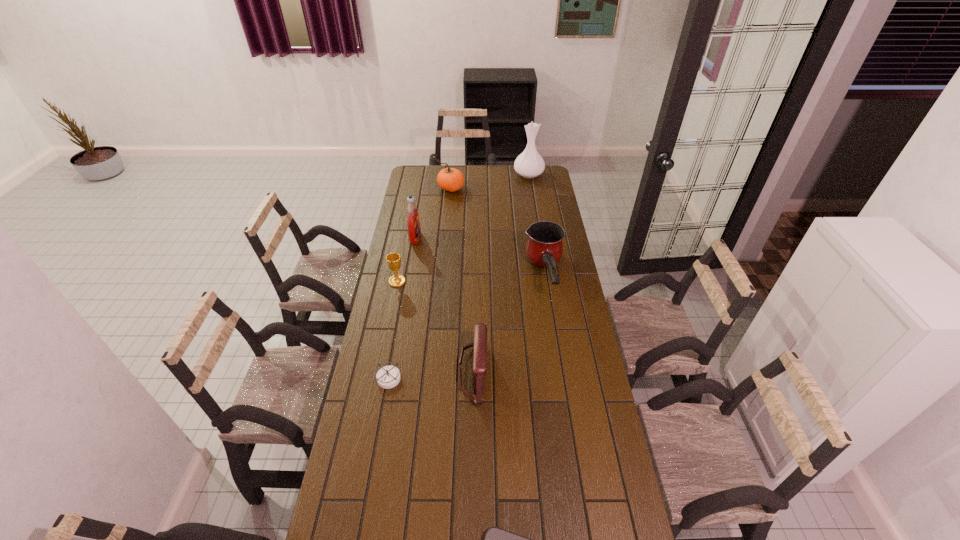
The width and height of the screenshot is (960, 540). Find the location of `vacant space situated 0.080m on the handle side of the fourth tallest object`. vacant space situated 0.080m on the handle side of the fourth tallest object is located at coordinates (553, 327).

Image resolution: width=960 pixels, height=540 pixels. Find the location of `free space located 0.320m on the front flap of the shoulder bag`. free space located 0.320m on the front flap of the shoulder bag is located at coordinates (573, 371).

Locate an element on the screen. vacant space located on the front of the chalice is located at coordinates [x=386, y=338].

Where is `vacant space located 0.360m on the right of the seventh tallest object`? The width and height of the screenshot is (960, 540). vacant space located 0.360m on the right of the seventh tallest object is located at coordinates (498, 378).

The image size is (960, 540). Identify the location of vase present at the far edge. (529, 164).

Find the location of `pumpkin present at the far edge`. pumpkin present at the far edge is located at coordinates (450, 179).

You are a GUI agent. You are given a task and a screenshot of the screen. Output one action in this format:
    pyautogui.click(x=<x>, y=<y>)
    Task: Click on the detergent present at the left edge
    
    Given the screenshot: What is the action you would take?
    pyautogui.click(x=413, y=222)

Where is `chalice positioned at the left edge`? This screenshot has width=960, height=540. chalice positioned at the left edge is located at coordinates (393, 260).

The height and width of the screenshot is (540, 960). What are the coordinates of `compass present at the left edge` in the screenshot? It's located at (387, 377).

Locate an element on the screen. vase present at the right edge is located at coordinates (529, 164).